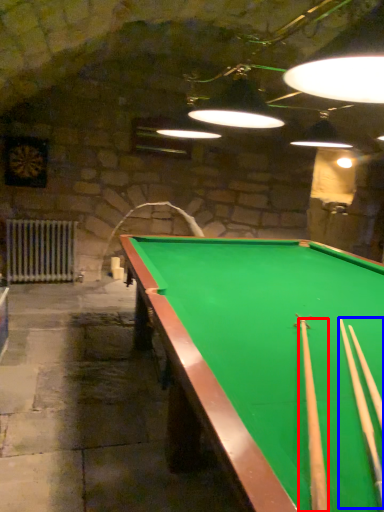
Question: Among these objects, which one is nearest to the camera, cue (highlighted by a red box) or cue (highlighted by a blue box)?

Choices:
 (A) cue
 (B) cue

Answer: (A)